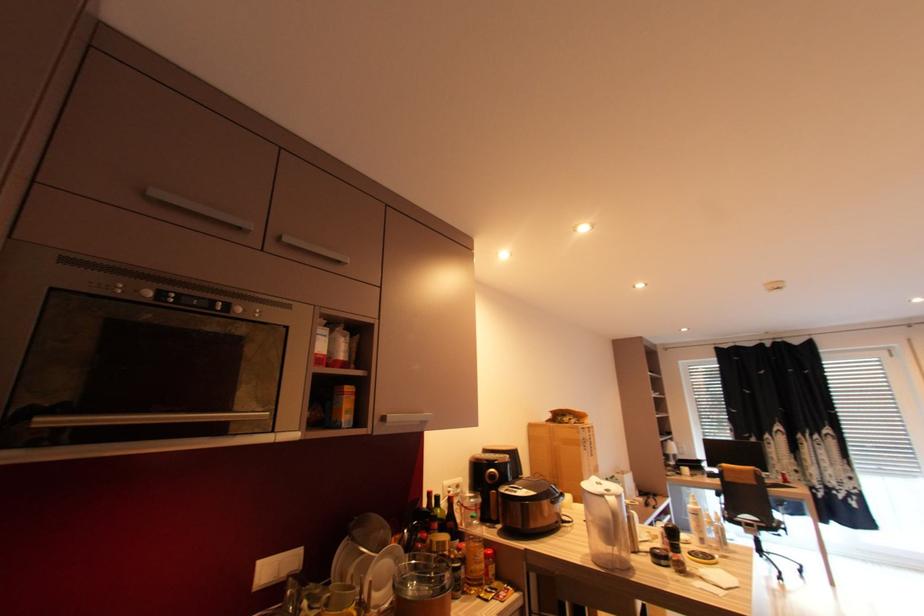
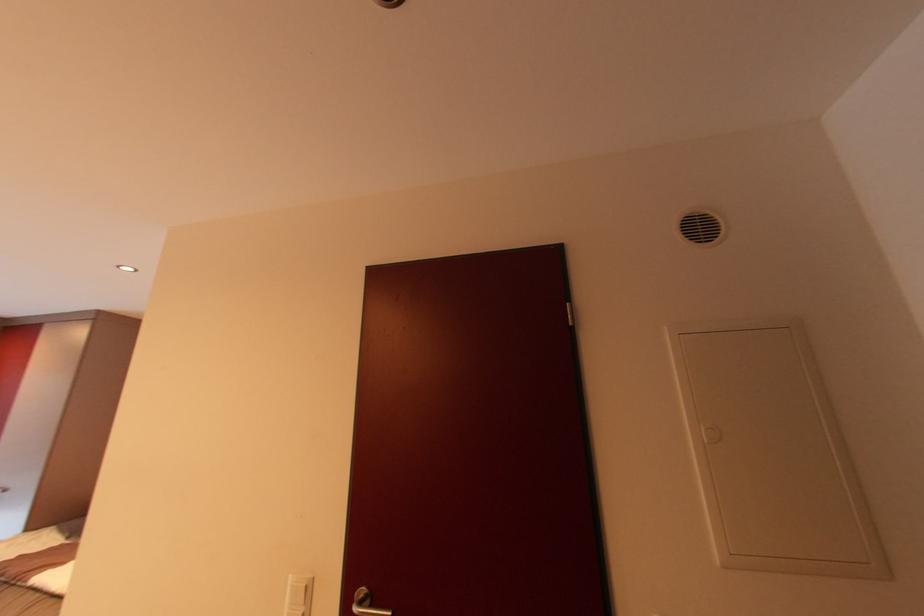
In the scene shown: The first image is from the beginning of the video and the second image is from the end. How did the camera likely rotate when shooting the video?

The camera's rotation is toward right-up.